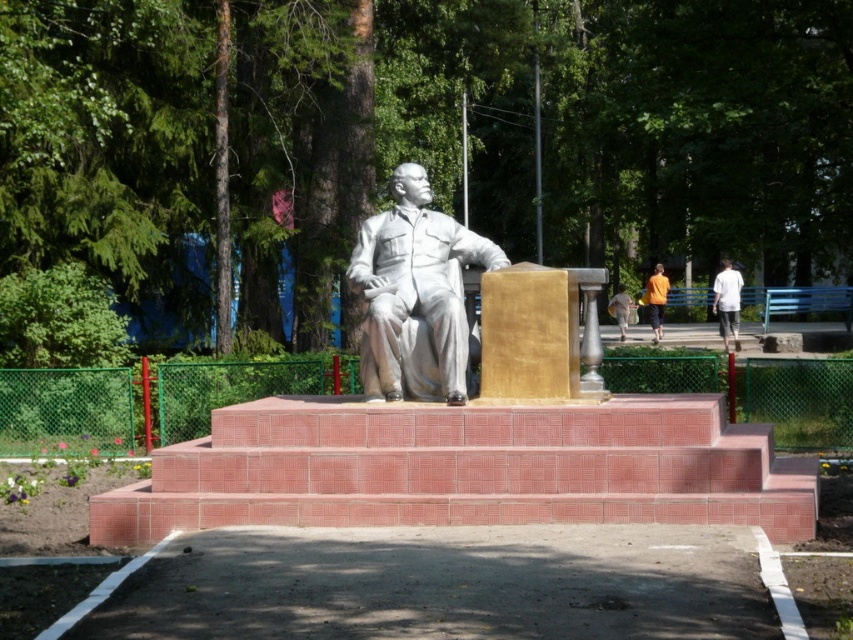
Who is taller, white marble statue at center or yellow shirt at center?

white marble statue at center

Which is above, white marble statue at center or yellow shirt at center?

yellow shirt at center is higher up.

Where is `white marble statue at center`? The image size is (853, 640). white marble statue at center is located at coordinates (415, 294).

Describe the element at coordinates (466, 468) in the screenshot. I see `red brick stairs at center` at that location.

Does red brick stairs at center appear on the right side of orange fabric shirt at right?

Incorrect, red brick stairs at center is not on the right side of orange fabric shirt at right.

Is point (399, 500) less distant than point (654, 340)?

Yes.

You are a GUI agent. You are given a task and a screenshot of the screen. Output one action in this format:
    pyautogui.click(x=<x>, y=<y>)
    Task: Click on the red brick stairs at center
    
    Given the screenshot: What is the action you would take?
    pyautogui.click(x=466, y=468)

Which of these two, orange fabric shirt at right or yellow shirt at center, stands taller?

orange fabric shirt at right

What do you see at coordinates (654, 300) in the screenshot? I see `orange fabric shirt at right` at bounding box center [654, 300].

Which is behind, point (653, 326) or point (619, 324)?

Positioned behind is point (619, 324).

The height and width of the screenshot is (640, 853). Identify the location of orange fabric shirt at right. [654, 300].